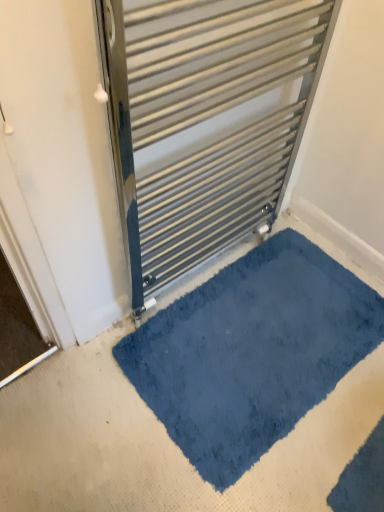
You are a GUI agent. You are given a task and a screenshot of the screen. Output one action in this format:
    pyautogui.click(x=<x>, y=<y>)
    Task: Click on the vacant region under blue plush bath mat at lower center (from a real-world perspective)
    Image resolution: width=384 pixels, height=512 pixels.
    Given the screenshot: What is the action you would take?
    pyautogui.click(x=230, y=362)